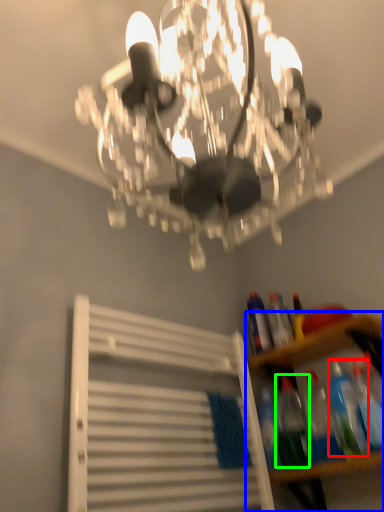
Question: Considering the real-world distances, which object is farthest from bottle (highlighted by a red box)? shelf (highlighted by a blue box) or bottle (highlighted by a green box)?

Choices:
 (A) shelf
 (B) bottle

Answer: (B)